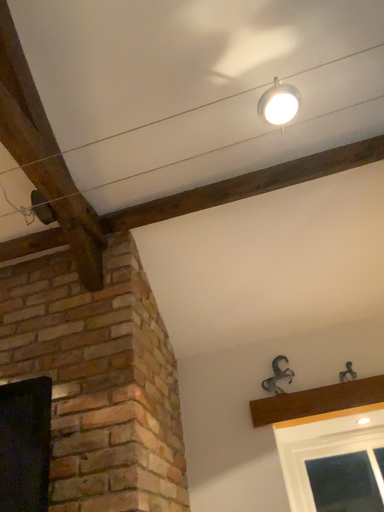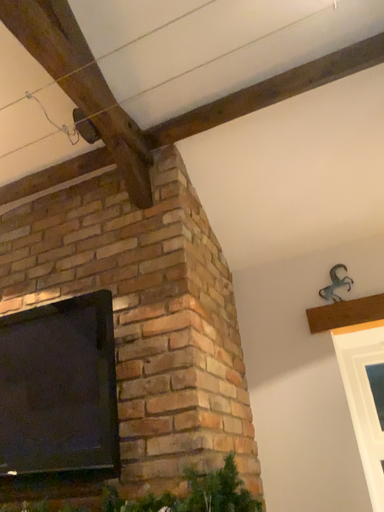
Question: Which way did the camera rotate in the video?

Choices:
 (A) rotated upward
 (B) rotated downward

Answer: (B)